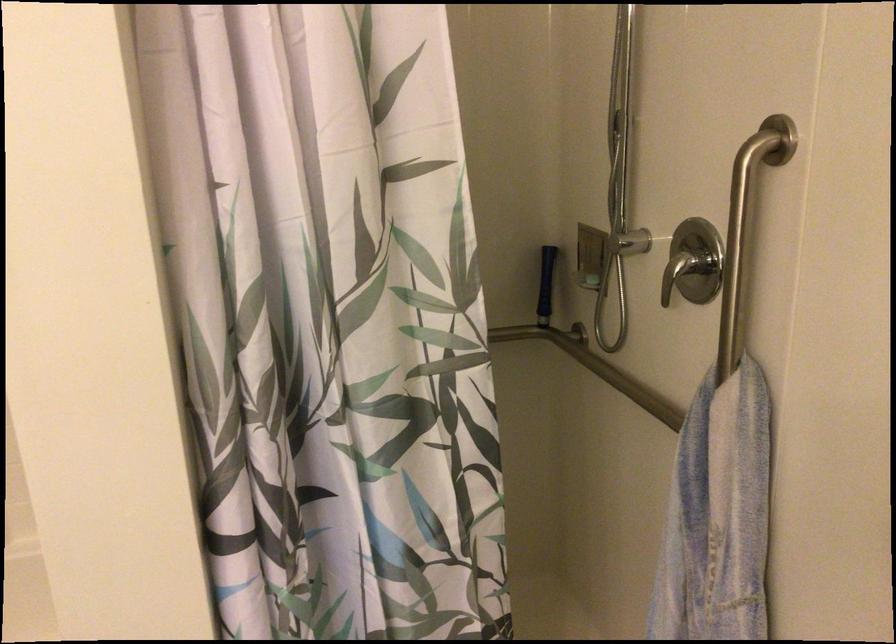
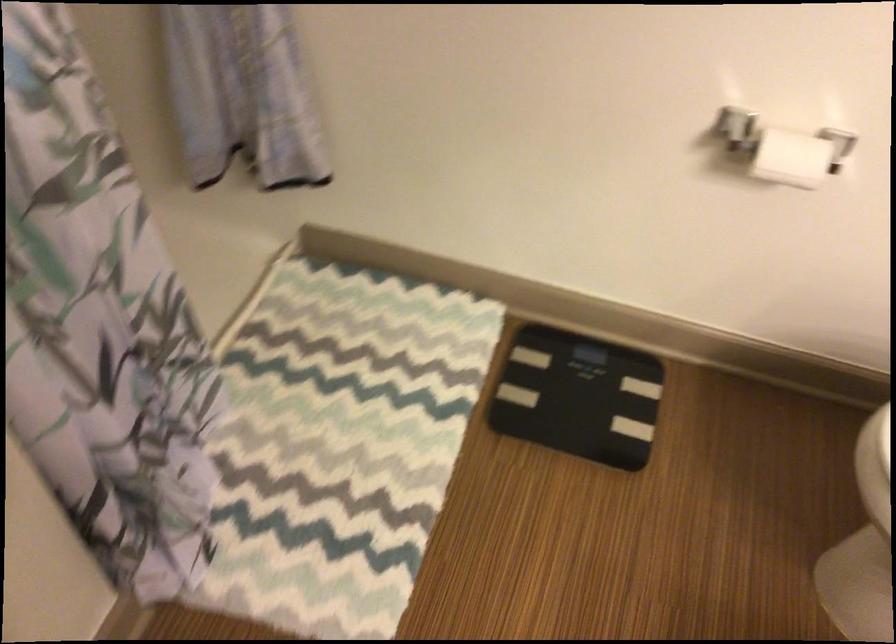
First-person continuous shooting, in which direction is the camera rotating?

The rotation direction of the camera is right-down.